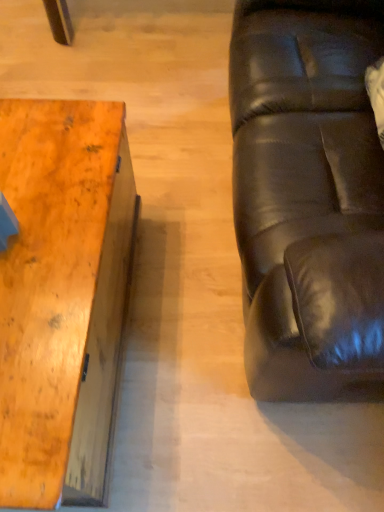
Describe the element at coordinates (62, 295) in the screenshot. I see `wooden table at left` at that location.

This screenshot has height=512, width=384. Find the location of `wooden table at left`. wooden table at left is located at coordinates (62, 295).

What are the coordinates of `black leather couch at right` in the screenshot? It's located at (308, 195).

What do you see at coordinates (308, 195) in the screenshot? Image resolution: width=384 pixels, height=512 pixels. I see `black leather couch at right` at bounding box center [308, 195].

Find the location of a particular element. wooden table at left is located at coordinates (62, 295).

From the picture: Considering the positions of objects black leather couch at right and wooden table at left in the image provided, who is more to the left, black leather couch at right or wooden table at left?

Positioned to the left is wooden table at left.

Who is more distant, black leather couch at right or wooden table at left?

wooden table at left is more distant.

Between point (275, 382) and point (20, 390), which one is positioned behind?

The point (275, 382) is farther.

From the image's perspective, which object appears higher, black leather couch at right or wooden table at left?

black leather couch at right, from the image's perspective.

From a real-world perspective, between black leather couch at right and wooden table at left, who is vertically higher?

From a 3D spatial view, black leather couch at right is above.

Which of these two, black leather couch at right or wooden table at left, is wider?

Wider between the two is black leather couch at right.

Is black leather couch at right taller than wooden table at left?

Yes, black leather couch at right is taller than wooden table at left.

Can you confirm if black leather couch at right is bigger than wooden table at left?

Yes, black leather couch at right is bigger than wooden table at left.

Based on the photo, choose the correct answer: Is black leather couch at right inside wooden table at left or outside it?

black leather couch at right is outside wooden table at left.

Is the surface of black leather couch at right in direct contact with wooden table at left?

black leather couch at right and wooden table at left are not in contact.

Could you tell me if black leather couch at right is facing wooden table at left?

Yes, black leather couch at right is aimed at wooden table at left.

Measure the distance from black leather couch at right to wooden table at left.

The distance of black leather couch at right from wooden table at left is 19.15 inches.

Where is `studio couch located above the wooden table at left (from the image's perspective)`? The width and height of the screenshot is (384, 512). studio couch located above the wooden table at left (from the image's perspective) is located at coordinates 308,195.

Based on their positions, is wooden table at left located to the left or right of black leather couch at right?

wooden table at left is to the left of black leather couch at right.

Is wooden table at left closer to the viewer compared to black leather couch at right?

No, wooden table at left is further to the viewer.

Between point (49, 135) and point (308, 37), which one is positioned behind?

The point (308, 37) is more distant.

From the image's perspective, which is above, wooden table at left or black leather couch at right?

From the image's view, black leather couch at right is above.

From a real-world perspective, is wooden table at left over black leather couch at right?

Incorrect, from a real-world perspective, wooden table at left is lower than black leather couch at right.

From the picture: Which of these two, wooden table at left or black leather couch at right, is thinner?

Thinner between the two is wooden table at left.

From the picture: Does wooden table at left have a greater height compared to black leather couch at right?

In fact, wooden table at left may be shorter than black leather couch at right.

Considering the relative sizes of wooden table at left and black leather couch at right in the image provided, is wooden table at left smaller than black leather couch at right?

Yes.

Is wooden table at left located outside black leather couch at right?

Yes.

Are wooden table at left and black leather couch at right beside each other?

No.

Consider the image. Is wooden table at left oriented away from black leather couch at right?

Yes.

How many degrees apart are the facing directions of wooden table at left and black leather couch at right?

The angle between the facing direction of wooden table at left and the facing direction of black leather couch at right is 0.995 degrees.

How distant is wooden table at left from black leather couch at right?

wooden table at left and black leather couch at right are 19.15 inches apart from each other.

Image resolution: width=384 pixels, height=512 pixels. Identify the location of studio couch that is in front of the wooden table at left. (308, 195).

Locate an element on the screen. The width and height of the screenshot is (384, 512). studio couch located in front of the wooden table at left is located at coordinates (308, 195).

Identify the location of studio couch above the wooden table at left (from the image's perspective). Image resolution: width=384 pixels, height=512 pixels. (308, 195).